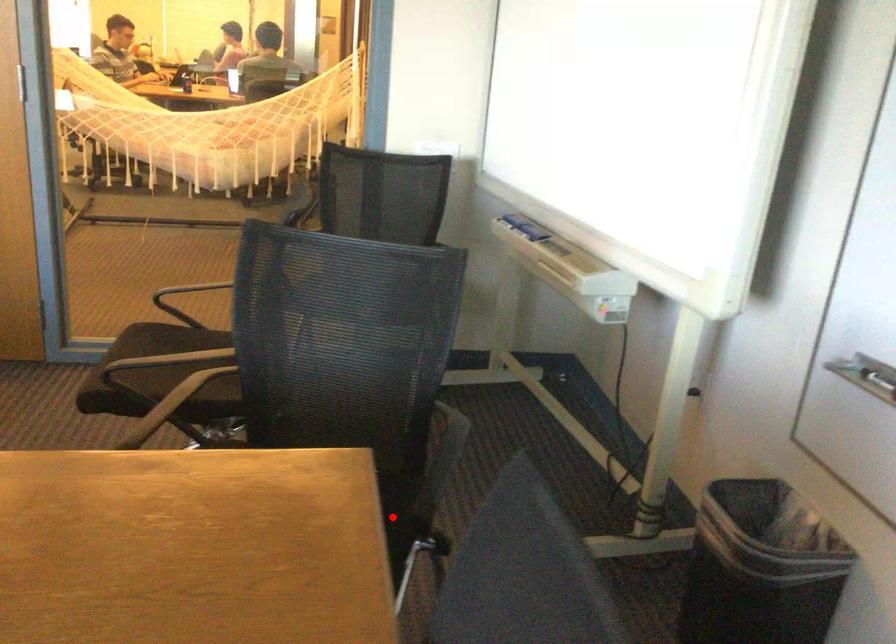
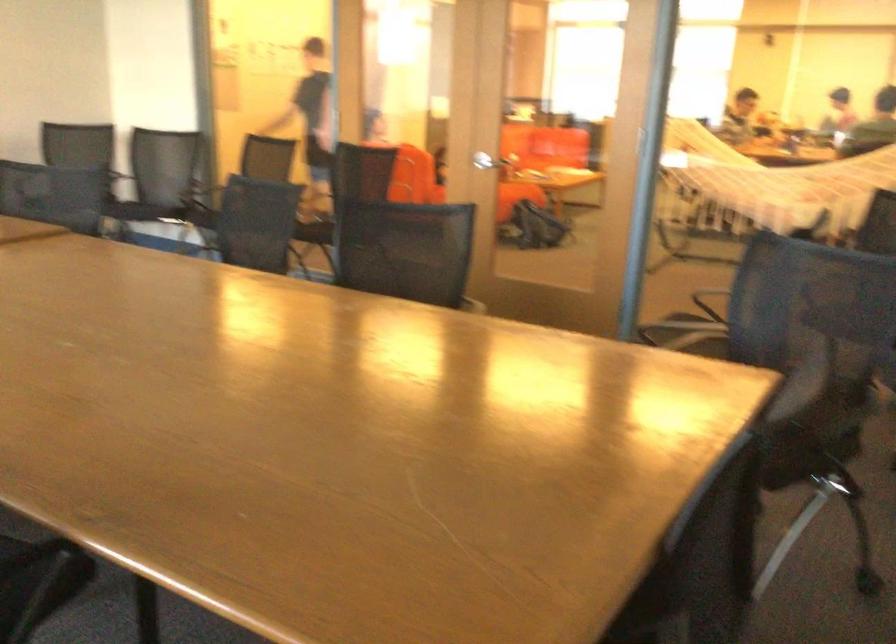
Find the pixel in the second image that matches the highlighted location in the first image.

(803, 453)